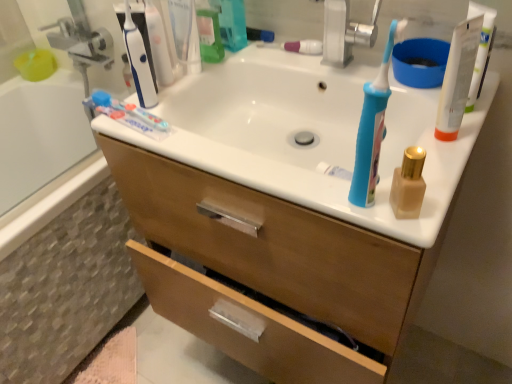
Locate an element on the screen. The image size is (512, 384). vacant space that's between blue plastic toothbrush at upper right and white glossy toothpaste at upper left, placed as the second toothpaste when sorted from right to left is located at coordinates (256, 164).